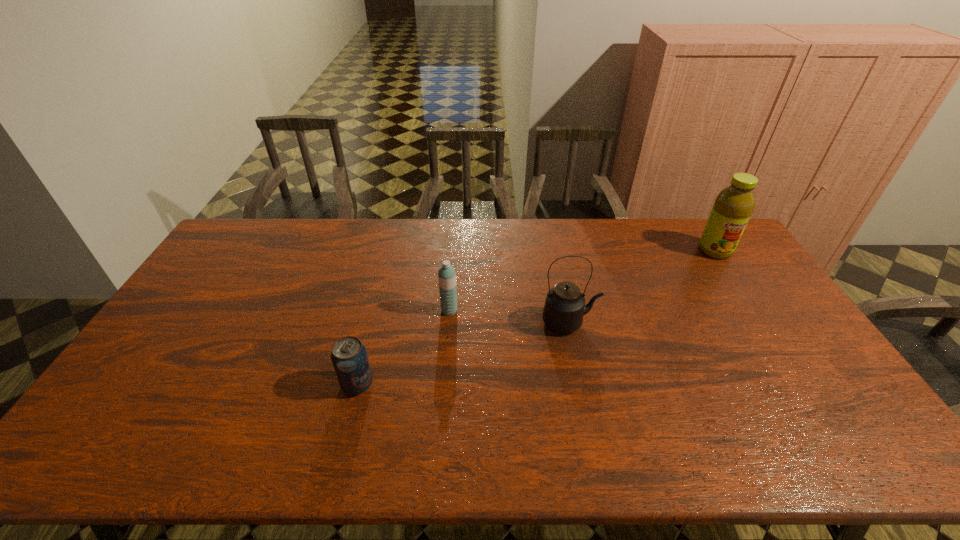
Find the location of a particular element. The height and width of the screenshot is (540, 960). fruit juice is located at coordinates (733, 206).

The width and height of the screenshot is (960, 540). Identify the location of the farthest object. (733, 206).

Where is `the third object from left to right`? The width and height of the screenshot is (960, 540). the third object from left to right is located at coordinates (564, 308).

The height and width of the screenshot is (540, 960). In order to click on water bottle in this screenshot , I will do `click(446, 275)`.

Locate an element on the screen. This screenshot has width=960, height=540. the third object from right to left is located at coordinates (446, 275).

The image size is (960, 540). Find the location of `the leftmost object`. the leftmost object is located at coordinates (349, 357).

The width and height of the screenshot is (960, 540). Identify the location of the shortest object. (349, 357).

Find the location of a particular element. The image size is (960, 540). free location located 0.200m on the front label of the rightmost object is located at coordinates (748, 301).

Identify the location of vacant space located 0.160m spout on the kettle. The width and height of the screenshot is (960, 540). (651, 322).

The image size is (960, 540). Find the location of `vacant area located 0.400m on the back of the second object from left to right`. vacant area located 0.400m on the back of the second object from left to right is located at coordinates (455, 231).